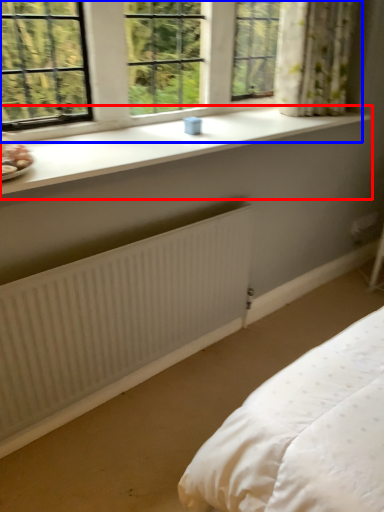
Question: Which object is closer to the camera taking this photo, window sill (highlighted by a red box) or window (highlighted by a blue box)?

Choices:
 (A) window sill
 (B) window

Answer: (A)